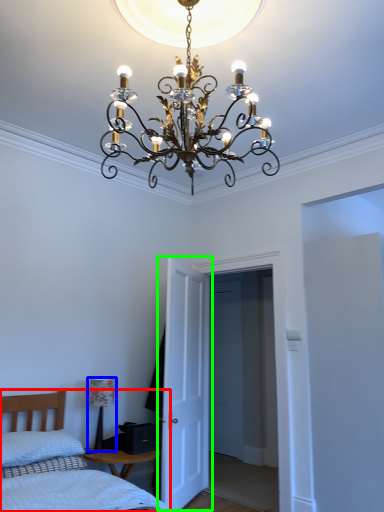
Question: Based on their relative distances, which object is nearer to bed (highlighted by a red box)? Choose from lamp (highlighted by a blue box) and door (highlighted by a green box).

Choices:
 (A) lamp
 (B) door

Answer: (A)